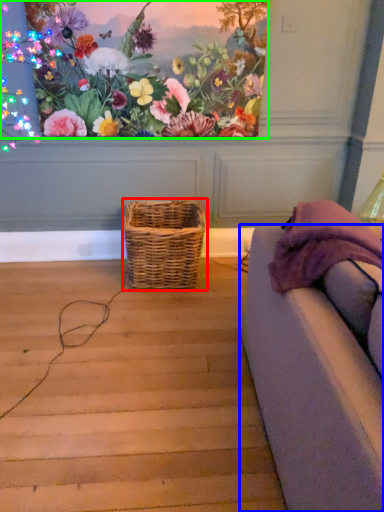
Question: Which object is the closest to the picnic basket (highlighted by a red box)? Choose among these: studio couch (highlighted by a blue box) or flower (highlighted by a green box).

Choices:
 (A) studio couch
 (B) flower

Answer: (B)